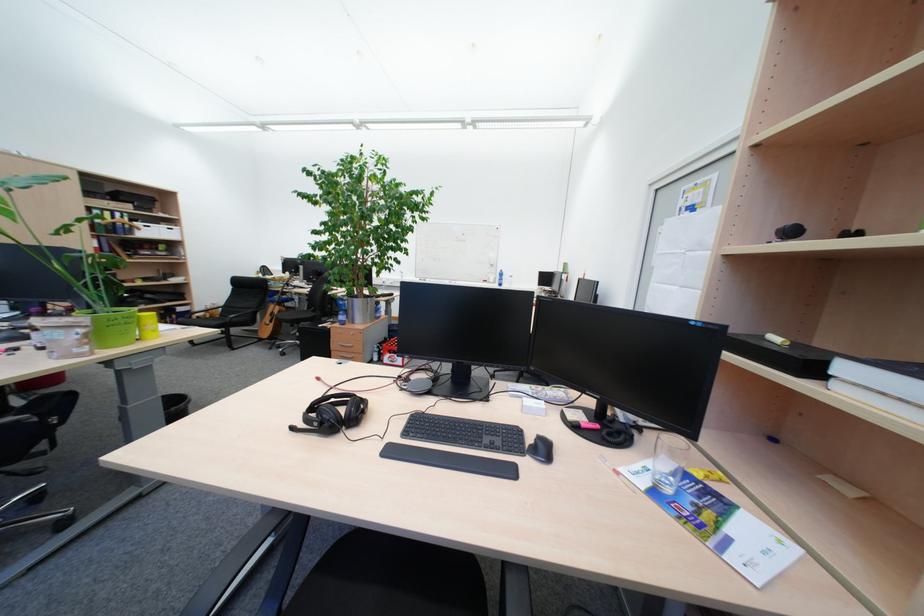
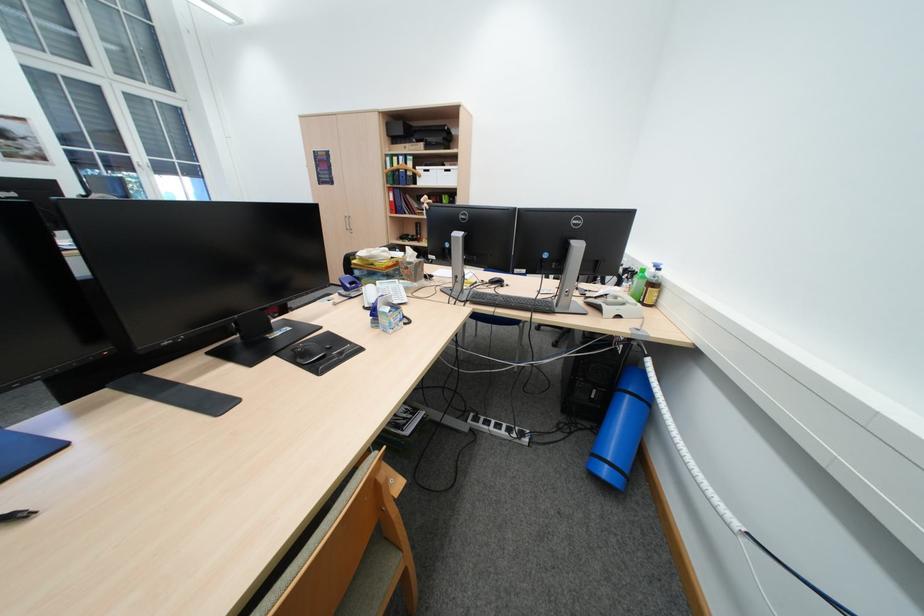
Locate, in the second image, the point that corresponds to (164,233) in the first image.

(442, 179)